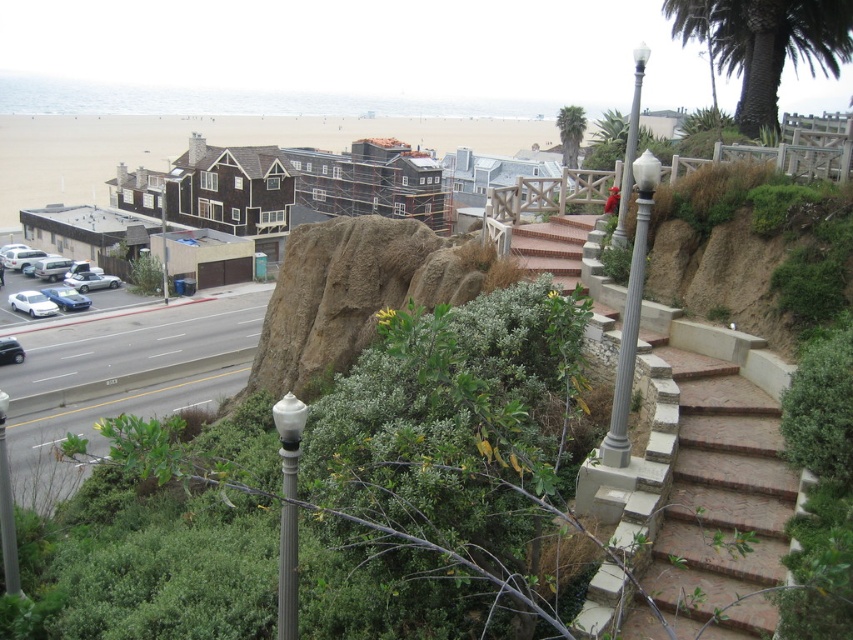
Consider the image. You are standing at the point closer to the foreground. Which point are you at, point (844,33) or point (279,529)?

You are at point (279,529) because it is closer to the foreground than point (844,33) which is behind it.